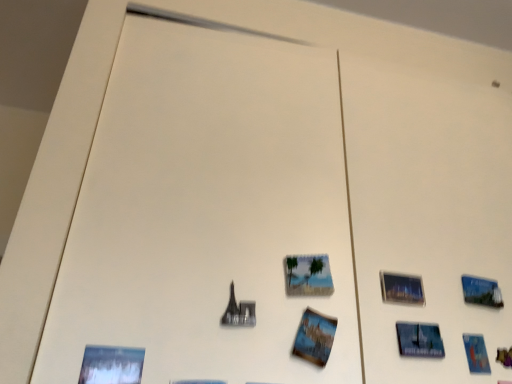
The width and height of the screenshot is (512, 384). I want to click on blue glossy postcard at lower right, the 1th postcard from the right, so click(476, 354).

Find the location of a particular element. metallic glass picture frame at upper right, marked as the 2th picture frame in a left-to-right arrangement is located at coordinates (401, 288).

At what (x,y) coordinates should I click in order to perform the action: click on matte plastic picture frame at center, which is the first picture frame from left to right. Please return your answer as a coordinate pair (x, y). The height and width of the screenshot is (384, 512). Looking at the image, I should click on (308, 275).

The width and height of the screenshot is (512, 384). I want to click on printed paper postcard at center, which is the second postcard from right to left, so click(315, 337).

In the scene shown: Considering the positions of objects matte plastic picture frame at center, the 2th picture frame in the right-to-left sequence, and printed paper postcard at center, the 1th postcard from the front, in the image provided, who is more to the left, matte plastic picture frame at center, the 2th picture frame in the right-to-left sequence, or printed paper postcard at center, the 1th postcard from the front,?

Positioned to the left is matte plastic picture frame at center, the 2th picture frame in the right-to-left sequence.

Can you tell me how much matte plastic picture frame at center, which is the first picture frame from left to right, and printed paper postcard at center, which is the second postcard from back to front, differ in facing direction?

0.479 degrees.

Could you tell me if matte plastic picture frame at center, which is the first picture frame from left to right, is turned towards printed paper postcard at center, which is the second postcard from back to front?

No, matte plastic picture frame at center, which is the first picture frame from left to right, is not facing towards printed paper postcard at center, which is the second postcard from back to front.

I want to click on postcard lying in front of the matte plastic picture frame at center, which is the first picture frame from left to right, so click(315, 337).

Between blue glossy postcard at lower right, placed as the 2th postcard when sorted from left to right, and printed paper postcard at center, which appears as the first postcard when viewed from the left, which one has larger width?

With larger width is printed paper postcard at center, which appears as the first postcard when viewed from the left.

From the image's perspective, is blue glossy postcard at lower right, placed as the 2th postcard when sorted from left to right, under printed paper postcard at center, the 1th postcard from the front?

Yes.

Considering the points (489, 370) and (322, 344), which point is in front, point (489, 370) or point (322, 344)?

Point (322, 344)

Relative to blue glossy postcard at lower right, the 1th postcard positioned from the back, is printed paper postcard at center, which is the second postcard from right to left, in front or behind?

Clearly, printed paper postcard at center, which is the second postcard from right to left, is in front of blue glossy postcard at lower right, the 1th postcard positioned from the back.

Is printed paper postcard at center, which is the second postcard from back to front, taller or shorter than blue glossy postcard at lower right, which ranks as the second postcard in front-to-back order?

Considering their sizes, printed paper postcard at center, which is the second postcard from back to front, has more height than blue glossy postcard at lower right, which ranks as the second postcard in front-to-back order.

From the image's perspective, does printed paper postcard at center, which is the second postcard from right to left, appear lower than blue glossy postcard at lower right, the 1th postcard from the right?

No.

Is printed paper postcard at center, which is the second postcard from right to left, situated inside blue glossy postcard at lower right, the 1th postcard positioned from the back, or outside?

printed paper postcard at center, which is the second postcard from right to left, is located beyond the bounds of blue glossy postcard at lower right, the 1th postcard positioned from the back.

Is printed paper postcard at center, which appears as the first postcard when viewed from the left, thinner than matte plastic picture frame at center, which is the first picture frame from left to right?

No, printed paper postcard at center, which appears as the first postcard when viewed from the left, is not thinner than matte plastic picture frame at center, which is the first picture frame from left to right.

Is printed paper postcard at center, the 1th postcard from the front, with matte plastic picture frame at center, the 2th picture frame in the right-to-left sequence?

Yes.

Does printed paper postcard at center, which is the second postcard from back to front, have a greater height compared to matte plastic picture frame at center, the 2th picture frame in the right-to-left sequence?

Yes, printed paper postcard at center, which is the second postcard from back to front, is taller than matte plastic picture frame at center, the 2th picture frame in the right-to-left sequence.

Is metallic glass picture frame at upper right, marked as the 2th picture frame in a left-to-right arrangement, at the right side of blue glossy postcard at lower right, the 1th postcard from the right?

Incorrect, metallic glass picture frame at upper right, marked as the 2th picture frame in a left-to-right arrangement, is not on the right side of blue glossy postcard at lower right, the 1th postcard from the right.

Is point (413, 303) closer to viewer compared to point (488, 363)?

That is False.

Which of these two, metallic glass picture frame at upper right, arranged as the first picture frame when viewed from the right, or blue glossy postcard at lower right, the 1th postcard from the right, is smaller?

blue glossy postcard at lower right, the 1th postcard from the right, is smaller.

Does metallic glass picture frame at upper right, arranged as the first picture frame when viewed from the right, turn towards blue glossy postcard at lower right, the 1th postcard positioned from the back?

No, metallic glass picture frame at upper right, arranged as the first picture frame when viewed from the right, is not facing towards blue glossy postcard at lower right, the 1th postcard positioned from the back.

Is point (399, 285) behind point (297, 289)?

Yes.

Is metallic glass picture frame at upper right, arranged as the first picture frame when viewed from the right, looking in the opposite direction of matte plastic picture frame at center, which is the first picture frame from left to right?

No, matte plastic picture frame at center, which is the first picture frame from left to right, is not at the back of metallic glass picture frame at upper right, arranged as the first picture frame when viewed from the right.

Is metallic glass picture frame at upper right, marked as the 2th picture frame in a left-to-right arrangement, bigger than matte plastic picture frame at center, which is the first picture frame from left to right?

Yes.

From the image's perspective, which one is positioned higher, metallic glass picture frame at upper right, marked as the 2th picture frame in a left-to-right arrangement, or matte plastic picture frame at center, the 2th picture frame in the right-to-left sequence?

matte plastic picture frame at center, the 2th picture frame in the right-to-left sequence, from the image's perspective.

From a real-world perspective, which is physically below, matte plastic picture frame at center, which is the first picture frame from left to right, or metallic glass picture frame at upper right, arranged as the first picture frame when viewed from the right?

From a 3D spatial view, metallic glass picture frame at upper right, arranged as the first picture frame when viewed from the right, is below.

From the image's perspective, who appears lower, matte plastic picture frame at center, which is the first picture frame from left to right, or metallic glass picture frame at upper right, marked as the 2th picture frame in a left-to-right arrangement?

metallic glass picture frame at upper right, marked as the 2th picture frame in a left-to-right arrangement.

Which object is positioned more to the left, matte plastic picture frame at center, the 2th picture frame in the right-to-left sequence, or metallic glass picture frame at upper right, arranged as the first picture frame when viewed from the right?

matte plastic picture frame at center, the 2th picture frame in the right-to-left sequence.

Is matte plastic picture frame at center, which is the first picture frame from left to right, further to the viewer compared to metallic glass picture frame at upper right, marked as the 2th picture frame in a left-to-right arrangement?

No.

Where is `the 1st postcard below the matte plastic picture frame at center, which is the first picture frame from left to right (from the image's perspective)`? The height and width of the screenshot is (384, 512). the 1st postcard below the matte plastic picture frame at center, which is the first picture frame from left to right (from the image's perspective) is located at coordinates (315, 337).

This screenshot has height=384, width=512. What are the coordinates of `postcard in front of the blue glossy postcard at lower right, placed as the 2th postcard when sorted from left to right` in the screenshot? It's located at (315, 337).

From the image, which object appears to be farther from matte plastic picture frame at center, the 2th picture frame in the right-to-left sequence, printed paper postcard at center, which appears as the first postcard when viewed from the left, or metallic glass picture frame at upper right, marked as the 2th picture frame in a left-to-right arrangement?

Among the two, metallic glass picture frame at upper right, marked as the 2th picture frame in a left-to-right arrangement, is located further to matte plastic picture frame at center, the 2th picture frame in the right-to-left sequence.

Looking at the image, which one is located closer to metallic glass picture frame at upper right, arranged as the first picture frame when viewed from the right, matte plastic picture frame at center, the 2th picture frame in the right-to-left sequence, or printed paper postcard at center, which is the second postcard from back to front?

matte plastic picture frame at center, the 2th picture frame in the right-to-left sequence, is positioned closer to the anchor metallic glass picture frame at upper right, arranged as the first picture frame when viewed from the right.

Looking at the image, which one is located further to printed paper postcard at center, the 1th postcard from the front, metallic glass picture frame at upper right, marked as the 2th picture frame in a left-to-right arrangement, or matte plastic picture frame at center, which is the first picture frame from left to right?

Among the two, metallic glass picture frame at upper right, marked as the 2th picture frame in a left-to-right arrangement, is located further to printed paper postcard at center, the 1th postcard from the front.

From the image, which object appears to be nearer to metallic glass picture frame at upper right, marked as the 2th picture frame in a left-to-right arrangement, blue glossy postcard at lower right, which ranks as the second postcard in front-to-back order, or printed paper postcard at center, the 1th postcard from the front?

blue glossy postcard at lower right, which ranks as the second postcard in front-to-back order, is closer to metallic glass picture frame at upper right, marked as the 2th picture frame in a left-to-right arrangement.

When comparing their distances from matte plastic picture frame at center, the 2th picture frame in the right-to-left sequence, does blue glossy postcard at lower right, placed as the 2th postcard when sorted from left to right, or metallic glass picture frame at upper right, marked as the 2th picture frame in a left-to-right arrangement, seem further?

The object further to matte plastic picture frame at center, the 2th picture frame in the right-to-left sequence, is blue glossy postcard at lower right, placed as the 2th postcard when sorted from left to right.

Based on the photo, estimate the real-world distances between objects in this image. Which object is further from blue glossy postcard at lower right, the 1th postcard from the right, printed paper postcard at center, the 1th postcard from the front, or matte plastic picture frame at center, the 2th picture frame in the right-to-left sequence?

matte plastic picture frame at center, the 2th picture frame in the right-to-left sequence.

When comparing their distances from printed paper postcard at center, the 1th postcard from the front, does metallic glass picture frame at upper right, arranged as the first picture frame when viewed from the right, or blue glossy postcard at lower right, the 1th postcard from the right, seem closer?

Among the two, metallic glass picture frame at upper right, arranged as the first picture frame when viewed from the right, is located nearer to printed paper postcard at center, the 1th postcard from the front.

From the image, which object appears to be farther from blue glossy postcard at lower right, the 1th postcard positioned from the back, matte plastic picture frame at center, the 2th picture frame in the right-to-left sequence, or printed paper postcard at center, which is the second postcard from right to left?

The object further to blue glossy postcard at lower right, the 1th postcard positioned from the back, is matte plastic picture frame at center, the 2th picture frame in the right-to-left sequence.

In order to click on postcard situated between matte plastic picture frame at center, the 2th picture frame in the right-to-left sequence, and metallic glass picture frame at upper right, marked as the 2th picture frame in a left-to-right arrangement, from left to right in this screenshot , I will do 315,337.

At what (x,y) coordinates should I click in order to perform the action: click on picture frame between matte plastic picture frame at center, which is the first picture frame from left to right, and blue glossy postcard at lower right, the 1th postcard positioned from the back. Please return your answer as a coordinate pair (x, y). This screenshot has width=512, height=384. Looking at the image, I should click on (401, 288).

Locate an element on the screen. The height and width of the screenshot is (384, 512). postcard situated between matte plastic picture frame at center, the 2th picture frame in the right-to-left sequence, and blue glossy postcard at lower right, which ranks as the second postcard in front-to-back order, from left to right is located at coordinates (315, 337).

Identify the location of picture frame between printed paper postcard at center, the 1th postcard from the front, and blue glossy postcard at lower right, which ranks as the second postcard in front-to-back order, in the horizontal direction. (401, 288).